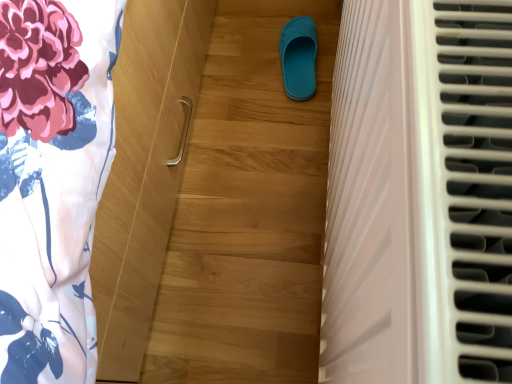
I want to click on white plastic radiator at right, so click(419, 195).

Image resolution: width=512 pixels, height=384 pixels. What do you see at coordinates (419, 195) in the screenshot?
I see `white plastic radiator at right` at bounding box center [419, 195].

What do you see at coordinates (298, 57) in the screenshot? The image size is (512, 384). I see `teal rubber slipper at center` at bounding box center [298, 57].

This screenshot has height=384, width=512. What are the coordinates of `teal rubber slipper at center` in the screenshot? It's located at (298, 57).

At what (x,y) coordinates should I click in order to perform the action: click on white plastic radiator at right. Please return your answer as a coordinate pair (x, y). Looking at the image, I should click on (419, 195).

Based on their positions, is teal rubber slipper at center located to the left or right of white plastic radiator at right?

teal rubber slipper at center is positioned on white plastic radiator at right's left side.

Does teal rubber slipper at center lie in front of white plastic radiator at right?

No, teal rubber slipper at center is further to the viewer.

Is point (302, 94) positioned after point (400, 191)?

Yes, point (302, 94) is farther from viewer.

From the image's perspective, does teal rubber slipper at center appear higher than white plastic radiator at right?

Yes, from the image's perspective, teal rubber slipper at center is over white plastic radiator at right.

From a real-world perspective, is teal rubber slipper at center physically above white plastic radiator at right?

No, from a real-world perspective, teal rubber slipper at center is not over white plastic radiator at right

Is teal rubber slipper at center wider than white plastic radiator at right?

No, teal rubber slipper at center is not wider than white plastic radiator at right.

Consider the image. Is teal rubber slipper at center taller or shorter than white plastic radiator at right?

Considering their sizes, teal rubber slipper at center has less height than white plastic radiator at right.

From the picture: Considering the sizes of teal rubber slipper at center and white plastic radiator at right in the image, is teal rubber slipper at center bigger or smaller than white plastic radiator at right?

teal rubber slipper at center is smaller than white plastic radiator at right.

Consider the image. Would you say teal rubber slipper at center is outside white plastic radiator at right?

Absolutely, teal rubber slipper at center is external to white plastic radiator at right.

Is there a large distance between teal rubber slipper at center and white plastic radiator at right?

That's not correct — teal rubber slipper at center is a little close to white plastic radiator at right.

Is teal rubber slipper at center positioned with its back to white plastic radiator at right?

No, teal rubber slipper at center's orientation is not away from white plastic radiator at right.

How many degrees apart are the facing directions of teal rubber slipper at center and white plastic radiator at right?

7.31 degrees separate the facing orientations of teal rubber slipper at center and white plastic radiator at right.

How distant is teal rubber slipper at center from white plastic radiator at right?

A distance of 29.37 inches exists between teal rubber slipper at center and white plastic radiator at right.

Find the location of a particular element. footwear behind the white plastic radiator at right is located at coordinates point(298,57).

Does white plastic radiator at right appear on the right side of teal rubber slipper at center?

Correct, you'll find white plastic radiator at right to the right of teal rubber slipper at center.

Does white plastic radiator at right lie behind teal rubber slipper at center?

No, white plastic radiator at right is in front of teal rubber slipper at center.

Which is behind, point (467, 221) or point (291, 85)?

Point (291, 85)

From the image's perspective, which one is positioned higher, white plastic radiator at right or teal rubber slipper at center?

teal rubber slipper at center.

From a real-world perspective, which object stands above the other?

white plastic radiator at right is physically above.

Does white plastic radiator at right have a greater width compared to teal rubber slipper at center?

Correct, the width of white plastic radiator at right exceeds that of teal rubber slipper at center.

From their relative heights in the image, would you say white plastic radiator at right is taller or shorter than teal rubber slipper at center?

Considering their sizes, white plastic radiator at right has more height than teal rubber slipper at center.

Considering the relative sizes of white plastic radiator at right and teal rubber slipper at center in the image provided, is white plastic radiator at right bigger than teal rubber slipper at center?

Indeed, white plastic radiator at right has a larger size compared to teal rubber slipper at center.

Can teal rubber slipper at center be found inside white plastic radiator at right?

No, teal rubber slipper at center is not surrounded by white plastic radiator at right.

Is white plastic radiator at right not close to teal rubber slipper at center?

white plastic radiator at right is near teal rubber slipper at center, not far away.

Is white plastic radiator at right looking in the opposite direction of teal rubber slipper at center?

No.

Measure the distance between white plastic radiator at right and teal rubber slipper at center.

white plastic radiator at right is 29.37 inches away from teal rubber slipper at center.

Identify the location of footwear that appears on the left of white plastic radiator at right. (298, 57).

Locate an element on the screen. This screenshot has height=384, width=512. air conditioning on the right of teal rubber slipper at center is located at coordinates (419, 195).

Image resolution: width=512 pixels, height=384 pixels. I want to click on air conditioning above the teal rubber slipper at center (from a real-world perspective), so click(419, 195).